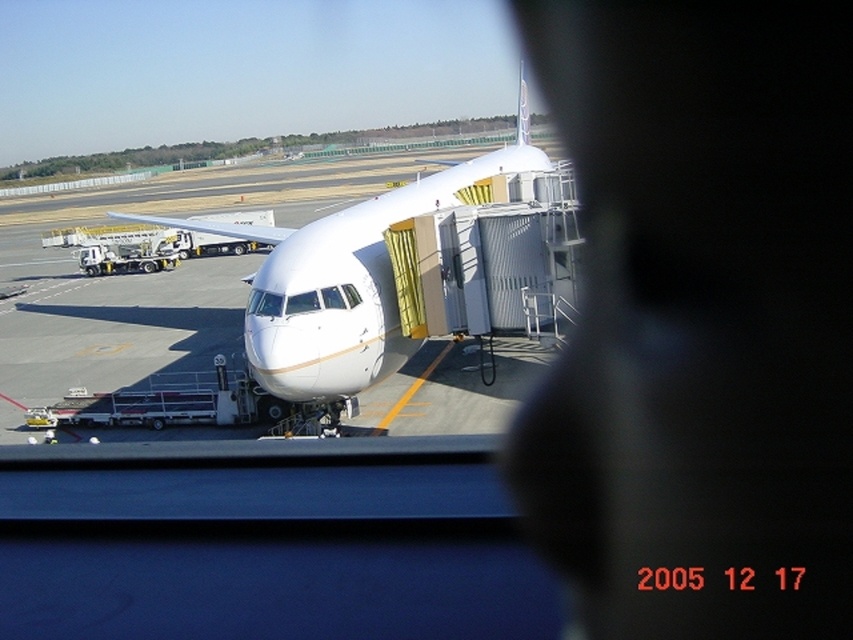
Can you confirm if white glossy airplane at center is positioned to the right of transparent glass airplane window at center?

Yes, white glossy airplane at center is to the right of transparent glass airplane window at center.

The image size is (853, 640). Describe the element at coordinates (345, 280) in the screenshot. I see `white glossy airplane at center` at that location.

Where is `white glossy airplane at center`? white glossy airplane at center is located at coordinates (345, 280).